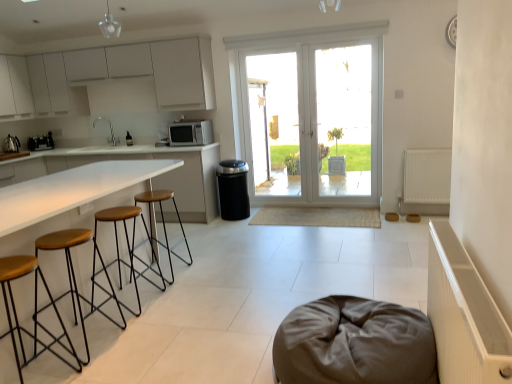
You are a GUI agent. You are given a task and a screenshot of the screen. Output one action in this format:
    pyautogui.click(x=<x>, y=<y>)
    Task: Click on the unoccupied space behind brown fabric bean bag at lower right
    The width and height of the screenshot is (512, 384).
    Given the screenshot: What is the action you would take?
    pyautogui.click(x=315, y=289)